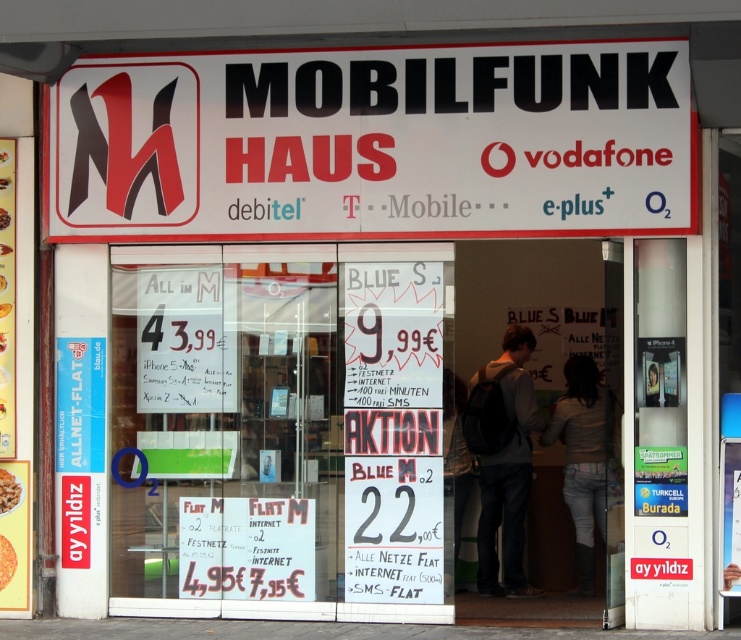
You are a customer entering the mobile phone shop and see the gray cotton hoodie at center and the denim jacket at center displayed in the window. Which clothing item is taller?

The gray cotton hoodie at center is taller than the denim jacket at center.

You are standing in front of the mobile phone shop and see two points on the storefront. The first point is at coordinate point [207,202] and the second is at point [576,586]. Which point is closer to you?

Point [207,202] is closer to the viewer than point [576,586].

What is located at the coordinates point (373, 144)?

At point (373, 144) lies a white plastic sign at upper center.